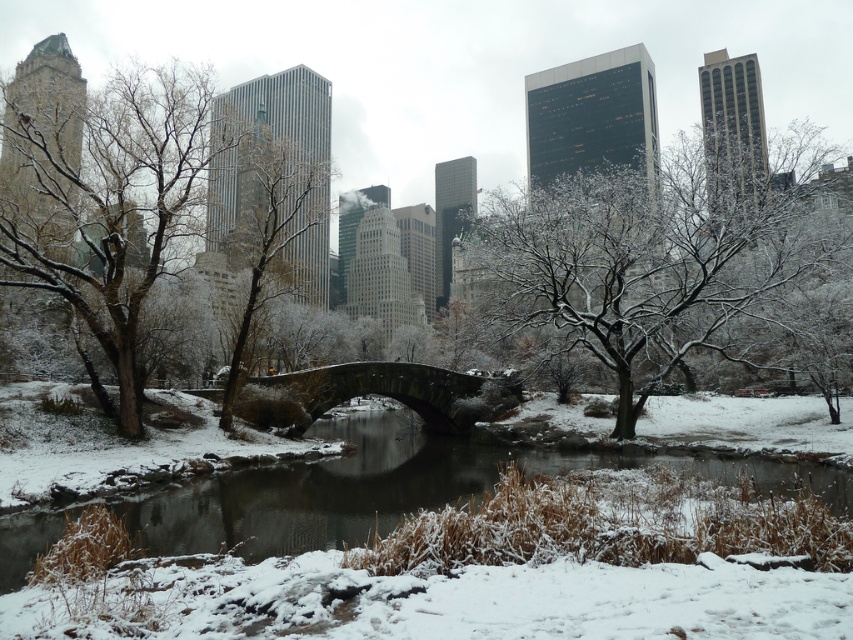
Question: Can you confirm if snow-covered tree at left is positioned to the left of snowy concrete bridge at center?

Choices:
 (A) yes
 (B) no

Answer: (A)

Question: In this image, where is white frosty tree at center located relative to snowy concrete bridge at center?

Choices:
 (A) above
 (B) below

Answer: (A)

Question: Which of the following is the farthest from the observer?

Choices:
 (A) snowy concrete bridge at center
 (B) dark gray stone bridge at center

Answer: (B)

Question: Among these points, which one is nearest to the camera?

Choices:
 (A) (306, 227)
 (B) (175, 196)

Answer: (B)

Question: Which point is farther to the camera?

Choices:
 (A) (462, 403)
 (B) (136, 534)
 (C) (260, 253)
 (D) (93, 259)

Answer: (A)

Question: Observing the image, what is the correct spatial positioning of white frosty tree at center in reference to snow-covered tree at center?

Choices:
 (A) below
 (B) above

Answer: (B)